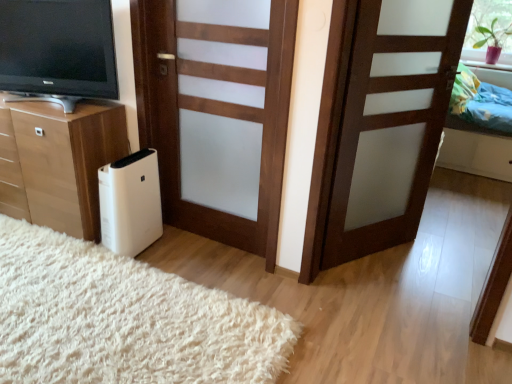
Question: From a real-world perspective, is matte black television at left physically located above or below wooden chest of drawers at lower left?

Choices:
 (A) below
 (B) above

Answer: (B)

Question: From the image's perspective, is matte black television at left above or below wooden chest of drawers at lower left?

Choices:
 (A) above
 (B) below

Answer: (A)

Question: Which object is the farthest from the wooden door at center, placed as the second door when sorted from right to left?

Choices:
 (A) green matte plant at upper right
 (B) matte black television at left
 (C) multicolored fabric bed at upper right
 (D) white plastic air purifier at lower left
 (E) white soft rug at lower left

Answer: (A)

Question: Based on their relative distances, which object is farther from the multicolored fabric bed at upper right?

Choices:
 (A) brown matte door at center, which is the second door in left-to-right order
 (B) wooden chest of drawers at lower left
 (C) white soft rug at lower left
 (D) green matte plant at upper right
 (E) matte black television at left

Answer: (E)